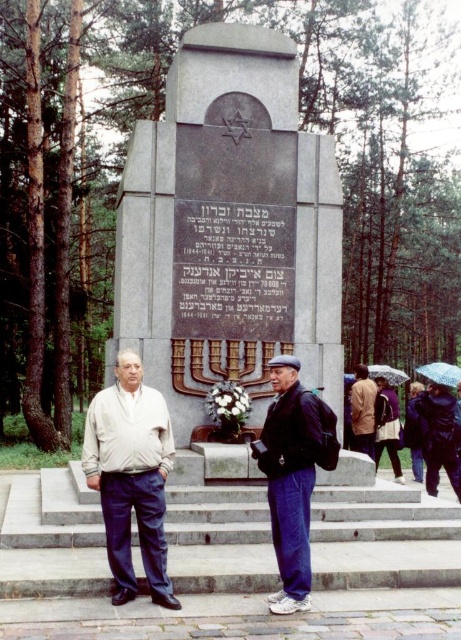
In the scene shown: How much distance is there between transparent plastic umbrella at center and transparent plastic umbrella at upper right?

10.76 feet

Who is more distant from viewer, (429, 364) or (386, 368)?

The point (429, 364) is more distant.

This screenshot has width=461, height=640. What are the coordinates of `transparent plastic umbrella at center` in the screenshot? It's located at (441, 372).

Which is in front, point (218, 300) or point (450, 365)?

Point (218, 300)

Between polished granite stone at center and transparent plastic umbrella at center, which one appears on the right side from the viewer's perspective?

Positioned to the right is transparent plastic umbrella at center.

Does point (165, 372) come in front of point (433, 364)?

Yes, it is in front of point (433, 364).

The height and width of the screenshot is (640, 461). Find the location of `polished granite stone at center`. polished granite stone at center is located at coordinates (229, 228).

Can you confirm if gray concrete stairs at center is positioned above brown leather jacket at center?

Actually, gray concrete stairs at center is below brown leather jacket at center.

You are a GUI agent. You are given a task and a screenshot of the screen. Output one action in this format:
    pyautogui.click(x=<x>, y=<y>)
    Task: Click on the gray concrete stairs at center
    This screenshot has width=461, height=640.
    Given the screenshot: What is the action you would take?
    pyautogui.click(x=380, y=531)